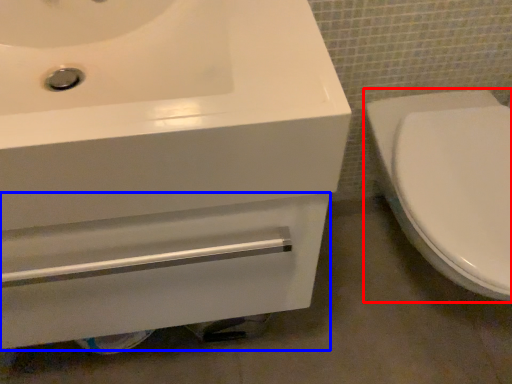
Question: Among these objects, which one is nearest to the camera, toilet (highlighted by a red box) or drawer (highlighted by a blue box)?

Choices:
 (A) toilet
 (B) drawer

Answer: (A)